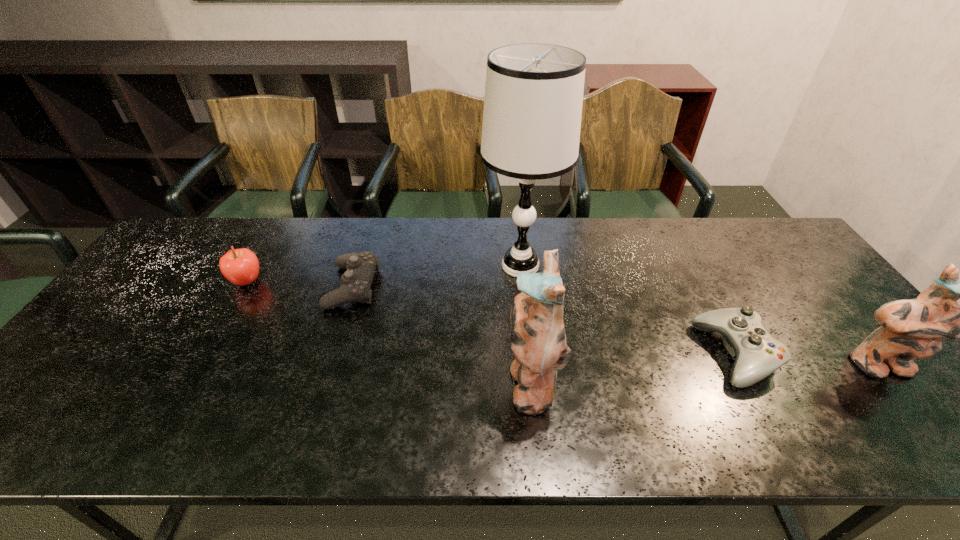
Locate an element on the screen. The width and height of the screenshot is (960, 540). control that is positioned at the far edge is located at coordinates click(360, 267).

Where is `control positioned at the near edge`? control positioned at the near edge is located at coordinates (758, 354).

I want to click on object that is at the right edge, so click(x=911, y=328).

The height and width of the screenshot is (540, 960). What are the coordinates of `object present at the near right corner` in the screenshot? It's located at (911, 328).

At what (x,y) coordinates should I click in order to perform the action: click on free space at the far edge. Please return your answer as a coordinate pair (x, y). The height and width of the screenshot is (540, 960). Looking at the image, I should click on (311, 224).

This screenshot has width=960, height=540. Identify the location of vacant space at the near edge of the desktop. (606, 403).

Locate an element on the screen. The height and width of the screenshot is (540, 960). free space at the right edge of the desktop is located at coordinates (772, 264).

Identify the location of vacant space at the far right corner of the desktop. (783, 241).

Locate an element on the screen. free location at the near right corner is located at coordinates (918, 398).

You are a GUI agent. You are given a task and a screenshot of the screen. Output one action in this format:
    pyautogui.click(x=<x>, y=<y>)
    Task: Click on the free space between the table lamp and the second object from left to right
    
    Given the screenshot: What is the action you would take?
    coord(437,276)